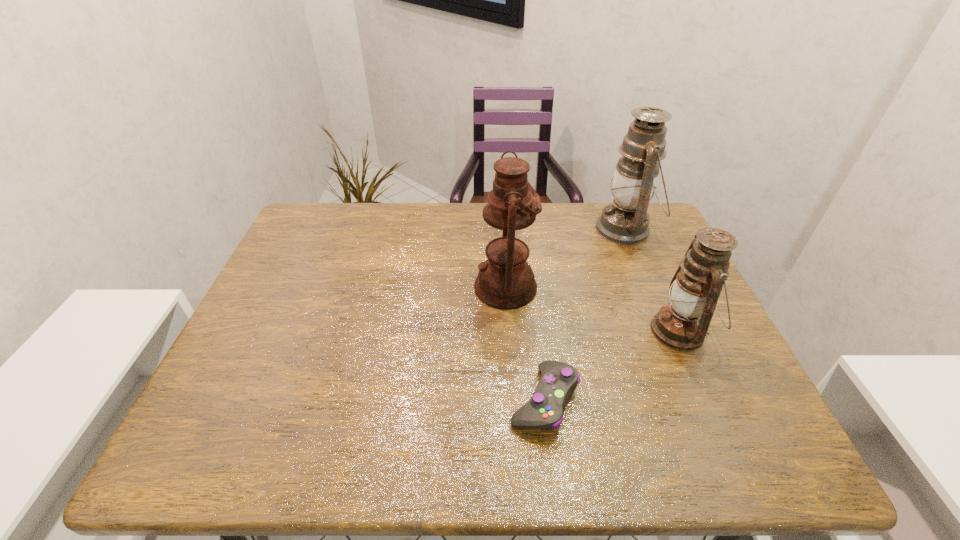
I want to click on object located at the near edge, so click(544, 411).

Locate an element on the screen. This screenshot has width=960, height=540. object located in the far right corner section of the desktop is located at coordinates (625, 221).

In the image, there is a desktop. Identify the location of vacant space at the far edge. (395, 239).

The width and height of the screenshot is (960, 540). I want to click on vacant space at the near edge of the desktop, so click(x=674, y=428).

The height and width of the screenshot is (540, 960). I want to click on vacant area at the left edge, so click(x=316, y=255).

Find the location of a particular element. The width and height of the screenshot is (960, 540). vacant space at the right edge is located at coordinates (672, 278).

At what (x,y) coordinates should I click in order to perform the action: click on vacant space at the far left corner. Please return your answer as a coordinate pair (x, y). Looking at the image, I should click on (340, 216).

Find the location of a particular element. free space between the farthest lantern and the shortest lantern is located at coordinates (653, 280).

You are a GUI agent. You are given a task and a screenshot of the screen. Output one action in this format:
    pyautogui.click(x=<x>, y=<y>)
    Task: Click on the vacant space in between the farthest object and the leftmost lantern
    
    Given the screenshot: What is the action you would take?
    pyautogui.click(x=565, y=258)

The image size is (960, 540). In order to click on free area in between the leftmost lantern and the farthest lantern in this screenshot , I will do `click(565, 258)`.